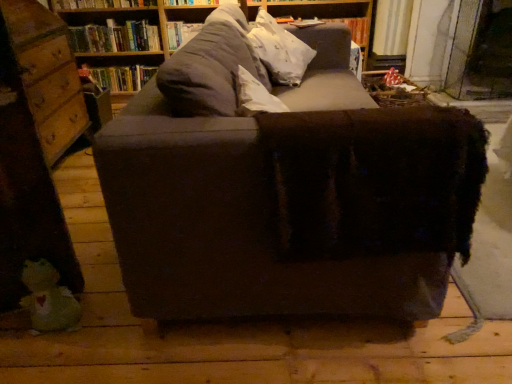
Question: From a real-world perspective, is transparent glass door at upper right physically above hardcover book at upper center, acting as the first book starting from the top?

Choices:
 (A) yes
 (B) no

Answer: (B)

Question: From the image's perspective, does transparent glass door at upper right appear higher than hardcover book at upper center, the second book from the bottom?

Choices:
 (A) yes
 (B) no

Answer: (B)

Question: Does transparent glass door at upper right have a larger size compared to hardcover book at upper center, acting as the first book starting from the top?

Choices:
 (A) no
 (B) yes

Answer: (B)

Question: Is hardcover book at upper center, acting as the first book starting from the top, inside transparent glass door at upper right?

Choices:
 (A) yes
 (B) no

Answer: (B)

Question: Could you tell me if transparent glass door at upper right is facing hardcover book at upper center, acting as the first book starting from the top?

Choices:
 (A) no
 (B) yes

Answer: (A)

Question: Does transparent glass door at upper right have a greater width compared to hardcover book at upper center, acting as the first book starting from the top?

Choices:
 (A) no
 (B) yes

Answer: (B)

Question: Is dark brown fabric couch at center a part of wooden drawer at left?

Choices:
 (A) no
 (B) yes

Answer: (A)

Question: From the image's perspective, is wooden drawer at left beneath dark brown fabric couch at center?

Choices:
 (A) yes
 (B) no

Answer: (B)

Question: From a real-world perspective, is wooden drawer at left over dark brown fabric couch at center?

Choices:
 (A) yes
 (B) no

Answer: (A)

Question: Can we say wooden drawer at left lies outside dark brown fabric couch at center?

Choices:
 (A) yes
 (B) no

Answer: (A)

Question: Does wooden drawer at left turn towards dark brown fabric couch at center?

Choices:
 (A) yes
 (B) no

Answer: (A)

Question: From a real-world perspective, is wooden drawer at left located beneath dark brown fabric couch at center?

Choices:
 (A) no
 (B) yes

Answer: (A)

Question: Does wooden drawer at left turn towards hardcover book at upper left, acting as the second book starting from the top?

Choices:
 (A) yes
 (B) no

Answer: (B)